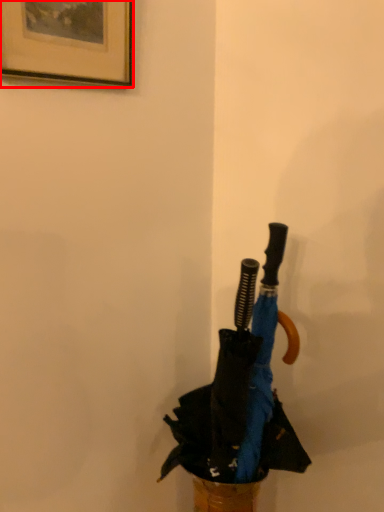
Question: Observing the image, what is the correct spatial positioning of picture frame (annotated by the red box) in reference to umbrella?

Choices:
 (A) right
 (B) left

Answer: (B)